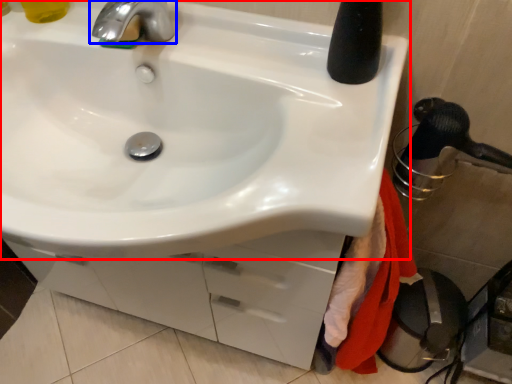
Question: Which object appears closest to the camera in this image, sink (highlighted by a red box) or tap (highlighted by a blue box)?

Choices:
 (A) sink
 (B) tap

Answer: (A)